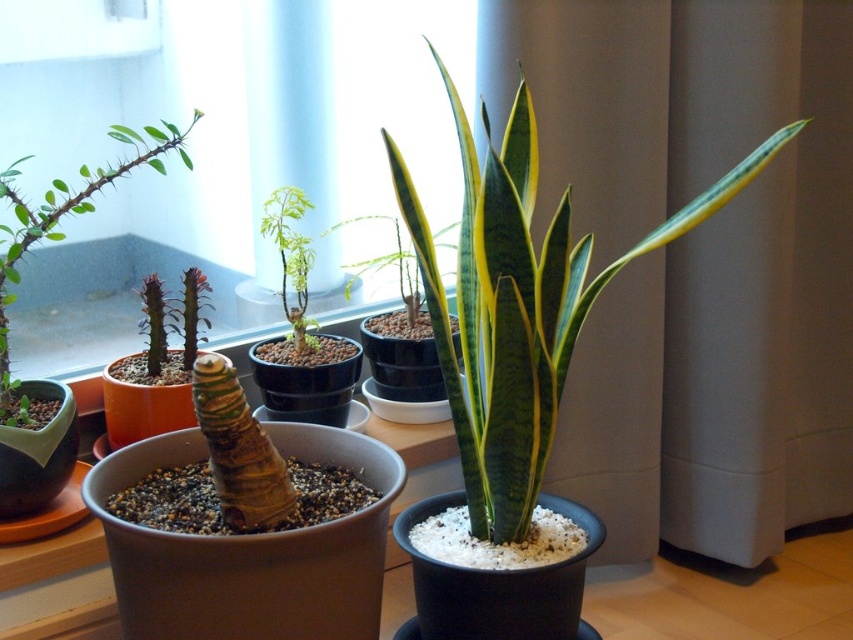
Who is more distant from viewer, (277,225) or (350,282)?

Point (350,282)

Is point (289, 243) positioned before point (373, 260)?

Yes, point (289, 243) is closer to viewer.

This screenshot has width=853, height=640. I want to click on green matte plant at center, so click(x=291, y=259).

Which of these two, green glossy snake plant at center or green matte plant at center, stands taller?

green glossy snake plant at center

Which is more to the left, green glossy snake plant at center or green matte plant at center?

green matte plant at center is more to the left.

Which is behind, point (494, 282) or point (306, 205)?

Point (306, 205)

At what (x,y) coordinates should I click in order to perform the action: click on green glossy snake plant at center. Please return your answer as a coordinate pair (x, y). Looking at the image, I should click on (520, 305).

Is green spiky cactus at left thinner than green matte plant at center?

Incorrect, green spiky cactus at left's width is not less than green matte plant at center's.

Is point (194, 124) farther from camera compared to point (265, 237)?

No, (194, 124) is in front of (265, 237).

Who is more distant from viewer, (131,170) or (287,202)?

Point (131,170)

Locate an element on the screen. green spiky cactus at left is located at coordinates (59, 224).